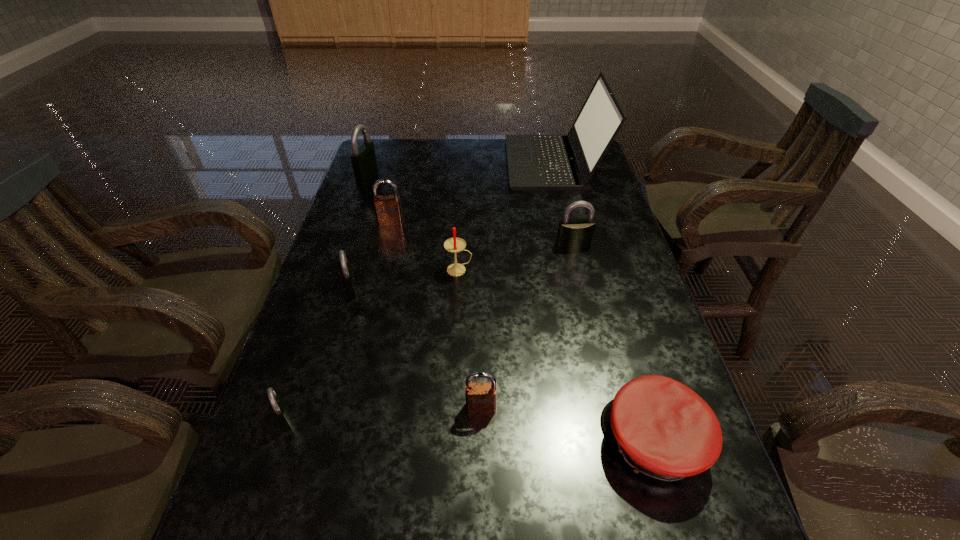
At what (x,y) coordinates should I click in order to perform the action: click on padlock that is at the far edge. Please return your answer as a coordinate pair (x, y). The height and width of the screenshot is (540, 960). Looking at the image, I should click on (364, 162).

Locate an element on the screen. laptop present at the right edge is located at coordinates (535, 162).

The image size is (960, 540). I want to click on padlock situated at the right edge, so click(573, 234).

This screenshot has width=960, height=540. I want to click on cap that is positioned at the right edge, so click(x=663, y=429).

The image size is (960, 540). I want to click on object at the far left corner, so click(x=364, y=162).

Where is `object present at the far right corner`? This screenshot has height=540, width=960. object present at the far right corner is located at coordinates (535, 162).

Where is `vacant point at the far edge`? This screenshot has height=540, width=960. vacant point at the far edge is located at coordinates (483, 159).

At what (x,y) coordinates should I click in order to perform the action: click on free space at the left edge. Please return your answer as a coordinate pair (x, y). The height and width of the screenshot is (540, 960). Looking at the image, I should click on (372, 239).

Locate an element on the screen. Image resolution: width=960 pixels, height=540 pixels. free space at the right edge of the desktop is located at coordinates (612, 353).

What are the coordinates of `vacant space at the far left corner` in the screenshot? It's located at (394, 154).